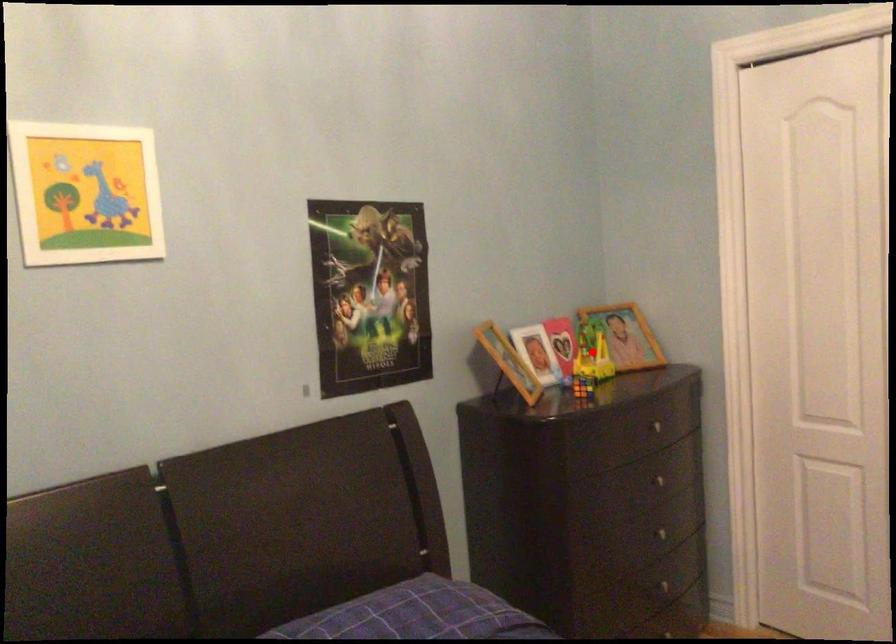
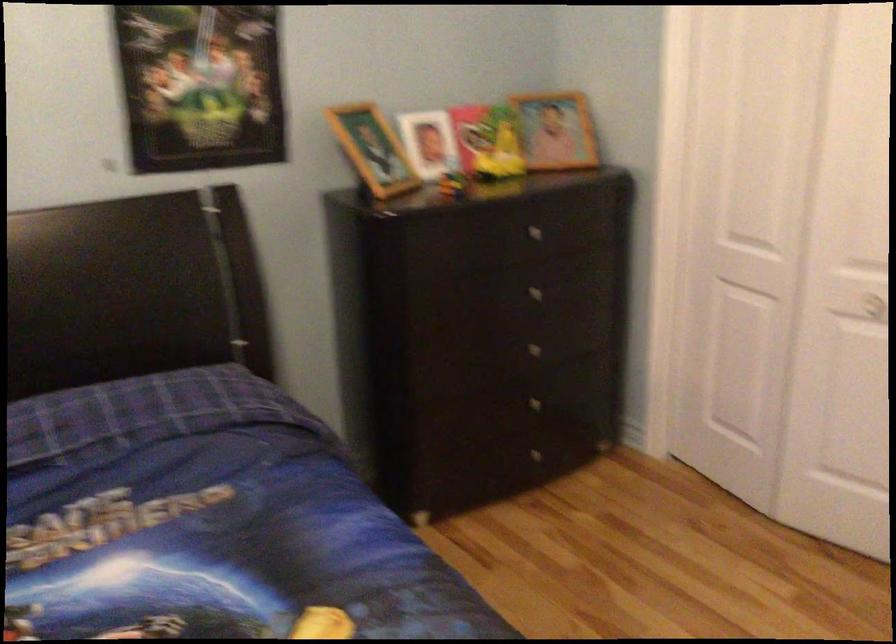
Question: I am providing you with two images of the same scene from different viewpoints. A red point is shown in image1. For the corresponding object point in image2, is it positioned nearer or farther from the camera?

Choices:
 (A) Nearer
 (B) Farther

Answer: (A)